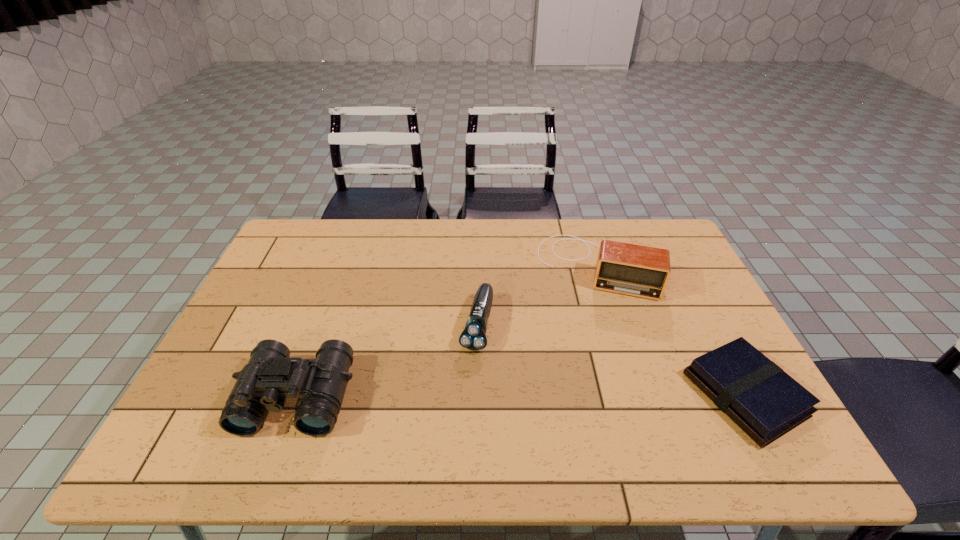
You are a GUI agent. You are given a task and a screenshot of the screen. Output one action in this format:
    pyautogui.click(x=<x>, y=<y>)
    Task: Click on the vacant space on the desktop that is between the leftmost object and the book and is positioned on the front-facing side of the third shortest object
    
    Given the screenshot: What is the action you would take?
    pyautogui.click(x=579, y=395)

Find the location of a particular element. free space on the desktop that is between the tallest object and the book and is positioned on the head of the second shortest object is located at coordinates (458, 396).